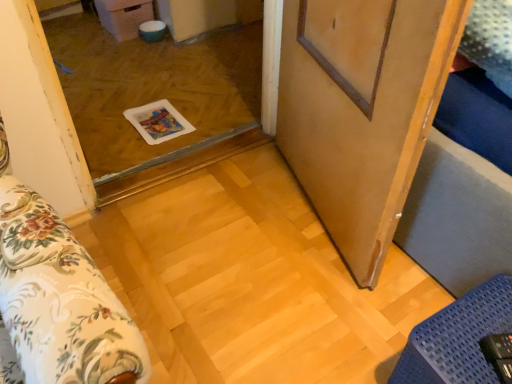
Find the location of a particular element. This screenshot has height=384, width=512. vacant point above blue textured mat at lower right (from a real-world perspective) is located at coordinates (474, 330).